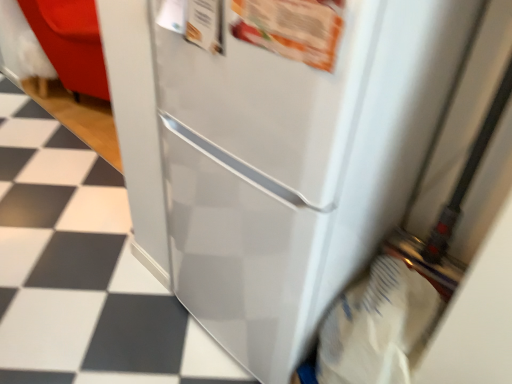
Question: Is the surface of white glossy tile at lower left, arranged as the 2th tile when viewed from the left, in direct contact with white paper grocery bag at lower right?

Choices:
 (A) yes
 (B) no

Answer: (B)

Question: Can we say white glossy tile at lower left, acting as the 2th tile starting from the top, lies outside white paper grocery bag at lower right?

Choices:
 (A) no
 (B) yes

Answer: (B)

Question: Is white glossy tile at lower left, the first tile positioned from the right, at the right side of white paper grocery bag at lower right?

Choices:
 (A) no
 (B) yes

Answer: (A)

Question: From the image's perspective, is white glossy tile at lower left, the 1th tile in the bottom-to-top sequence, below white paper grocery bag at lower right?

Choices:
 (A) yes
 (B) no

Answer: (B)

Question: Does white glossy tile at lower left, the first tile positioned from the right, lie behind white paper grocery bag at lower right?

Choices:
 (A) yes
 (B) no

Answer: (A)

Question: Do you think white paper grocery bag at lower right is within white glossy tile at lower left, positioned as the 2th tile in right-to-left order, or outside of it?

Choices:
 (A) inside
 (B) outside

Answer: (B)

Question: Is white paper grocery bag at lower right to the left or to the right of white glossy tile at lower left, arranged as the first tile when viewed from the left, in the image?

Choices:
 (A) left
 (B) right

Answer: (B)

Question: Considering the positions of white paper grocery bag at lower right and white glossy tile at lower left, arranged as the first tile when viewed from the left, in the image, is white paper grocery bag at lower right bigger or smaller than white glossy tile at lower left, arranged as the first tile when viewed from the left,?

Choices:
 (A) big
 (B) small

Answer: (A)

Question: Relative to white glossy tile at lower left, placed as the second tile when sorted from bottom to top, is white paper grocery bag at lower right in front or behind?

Choices:
 (A) front
 (B) behind

Answer: (A)

Question: From their relative heights in the image, would you say white glossy tile at lower left, arranged as the first tile when viewed from the left, is taller or shorter than white paper grocery bag at lower right?

Choices:
 (A) short
 (B) tall

Answer: (A)

Question: Which is correct: white glossy tile at lower left, arranged as the 1th tile when viewed from the back, is inside white paper grocery bag at lower right, or outside of it?

Choices:
 (A) outside
 (B) inside

Answer: (A)

Question: Is white glossy tile at lower left, arranged as the first tile when viewed from the left, bigger or smaller than white paper grocery bag at lower right?

Choices:
 (A) big
 (B) small

Answer: (B)

Question: In the image, is white glossy tile at lower left, arranged as the first tile when viewed from the left, on the left side or the right side of white paper grocery bag at lower right?

Choices:
 (A) right
 (B) left

Answer: (B)

Question: Based on their sizes in the image, would you say white glossy tile at lower left, the first tile positioned from the right, is bigger or smaller than white glossy tile at lower left, the 2th tile viewed from the front?

Choices:
 (A) big
 (B) small

Answer: (B)

Question: Is white glossy tile at lower left, the second tile positioned from the back, situated inside white glossy tile at lower left, acting as the first tile starting from the top, or outside?

Choices:
 (A) outside
 (B) inside

Answer: (A)